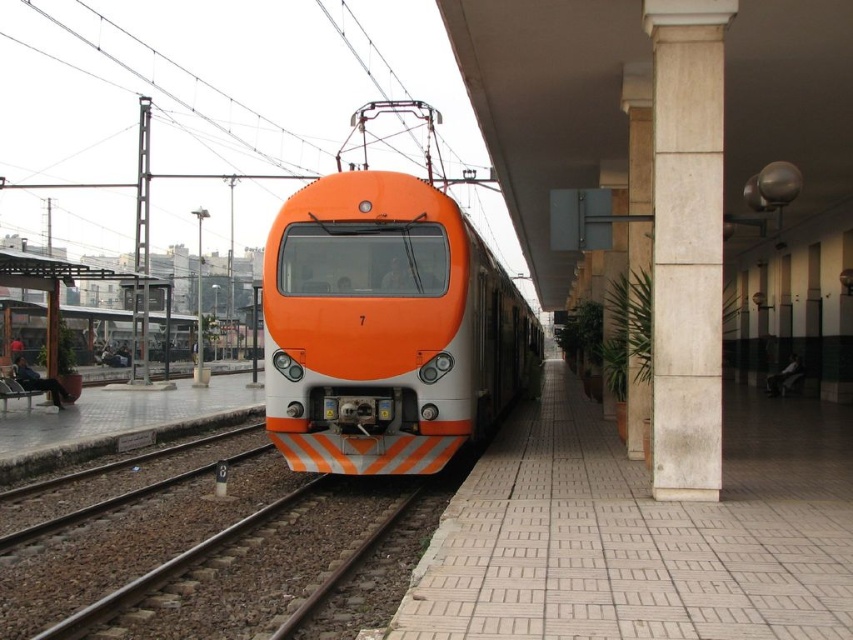
You are standing at the platform of the train station. You see the orange glossy train at center. Where is the point with coordinates (386, 326) located?

The point with coordinates (386, 326) is located on the orange glossy train at center.

You are standing at the station platform and want to walk from point A to point B. Point A is located at point [494,323] and point B is at point [262,611]. Which direction should you walk to reach point B from point A?

To reach point B from point A, you should walk forward because point A is behind point B according to their coordinates.